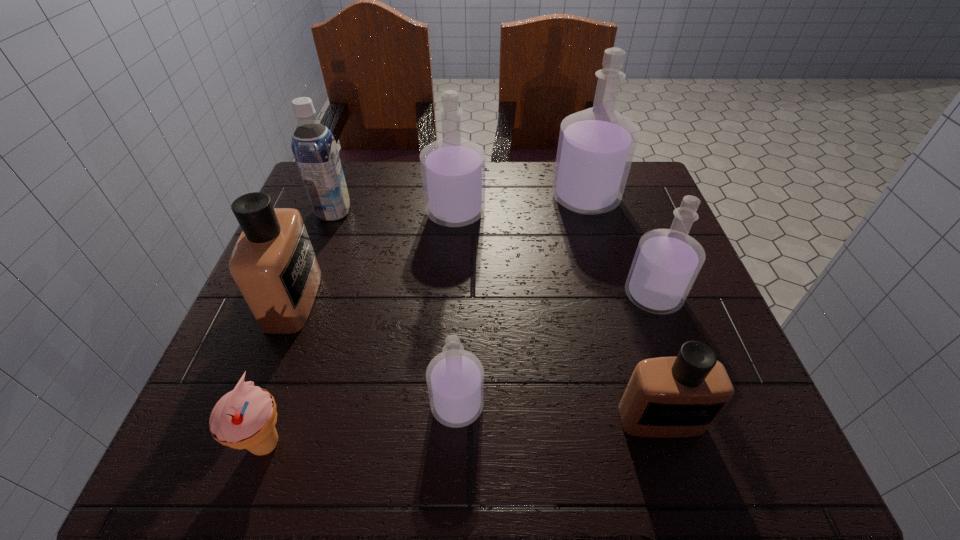
Locate an element on the screen. Image resolution: width=960 pixels, height=540 pixels. vacant point that satisfies the following two spatial constraints: 1. on the back side of the smallest purple perfume; 2. on the label of the soya milk is located at coordinates (465, 212).

Locate an element on the screen. free space in the image that satisfies the following two spatial constraints: 1. on the label of the soya milk; 2. on the left side of the icecream is located at coordinates 246,444.

Where is `free spot that satisfies the following two spatial constraints: 1. on the back side of the nearest purple perfume; 2. on the right side of the icecream`? This screenshot has width=960, height=540. free spot that satisfies the following two spatial constraints: 1. on the back side of the nearest purple perfume; 2. on the right side of the icecream is located at coordinates (279, 405).

What are the coordinates of `vacant space that satisfies the following two spatial constraints: 1. on the front side of the biggest purple perfume; 2. on the label of the soya milk` in the screenshot? It's located at (589, 212).